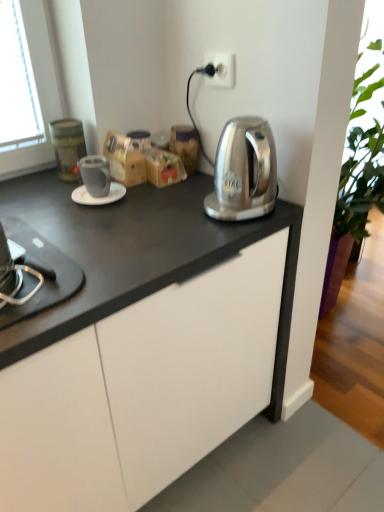
Where is `free location to the right of white glossy saucer at center`? The image size is (384, 512). free location to the right of white glossy saucer at center is located at coordinates (157, 201).